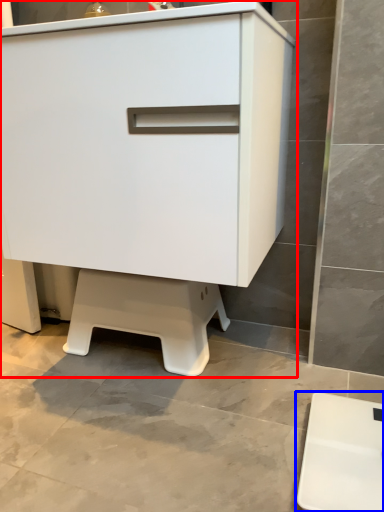
Question: Which point is closer to the camera, chest of drawers (highlighted by a red box) or furniture (highlighted by a blue box)?

Choices:
 (A) chest of drawers
 (B) furniture

Answer: (B)